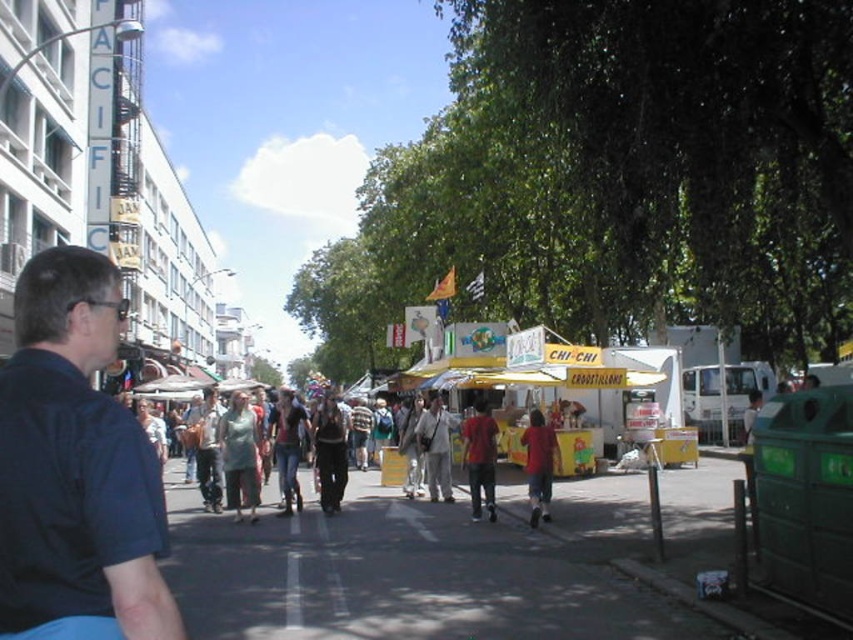
How far apart are dark blue shirt at left and matte red shirt at center?

dark blue shirt at left is 10.10 meters away from matte red shirt at center.

Describe the element at coordinates (74, 464) in the screenshot. This screenshot has width=853, height=640. I see `dark blue shirt at left` at that location.

This screenshot has height=640, width=853. Identify the location of dark blue shirt at left. (x=74, y=464).

Is dark gray asphalt at center to the right of dark blue shirt at left from the viewer's perspective?

Correct, you'll find dark gray asphalt at center to the right of dark blue shirt at left.

In the scene shown: Which of these two, dark gray asphalt at center or dark blue shirt at left, stands taller?

With more height is dark blue shirt at left.

Does point (285, 611) lie in front of point (96, 284)?

No, it is behind (96, 284).

Where is `dark gray asphalt at center`? This screenshot has width=853, height=640. dark gray asphalt at center is located at coordinates (422, 570).

Is dark gray asphalt at center further to camera compared to matte red shirt at center?

No, it is not.

Does dark gray asphalt at center appear on the right side of matte red shirt at center?

In fact, dark gray asphalt at center is to the left of matte red shirt at center.

What do you see at coordinates (422, 570) in the screenshot?
I see `dark gray asphalt at center` at bounding box center [422, 570].

Where is `dark gray asphalt at center`? The height and width of the screenshot is (640, 853). dark gray asphalt at center is located at coordinates (422, 570).